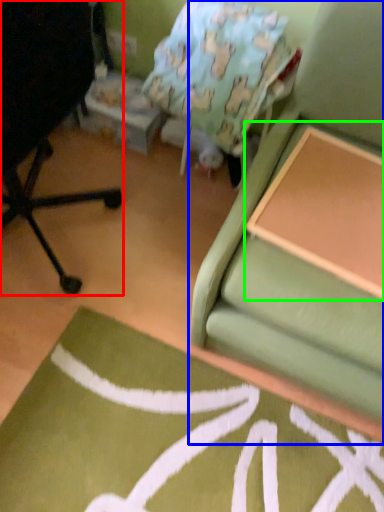
Question: Based on their relative distances, which object is farther from chair (highlighted by a red box)? Choose from studio couch (highlighted by a blue box) and table (highlighted by a green box).

Choices:
 (A) studio couch
 (B) table

Answer: (B)